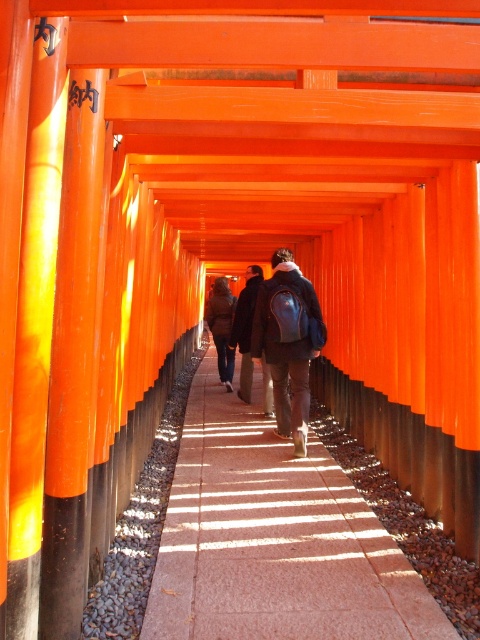
Question: Which point is closer to the camera?

Choices:
 (A) (276, 310)
 (B) (344, 481)

Answer: (B)

Question: Is smooth stone pavement at center to the right of matte black backpack at center from the viewer's perspective?

Choices:
 (A) yes
 (B) no

Answer: (B)

Question: Does smooth stone pavement at center have a larger size compared to matte black backpack at center?

Choices:
 (A) yes
 (B) no

Answer: (B)

Question: Which of the following is the farthest from the observer?

Choices:
 (A) (280, 276)
 (B) (181, 620)
 (C) (244, 369)

Answer: (C)

Question: Which object appears farthest from the camera in this image?

Choices:
 (A) matte black backpack at center
 (B) smooth stone pavement at center
 (C) dark brown leather jacket at center

Answer: (C)

Question: In this image, where is matte black backpack at center located relative to dark brown leather jacket at center?

Choices:
 (A) right
 (B) left

Answer: (A)